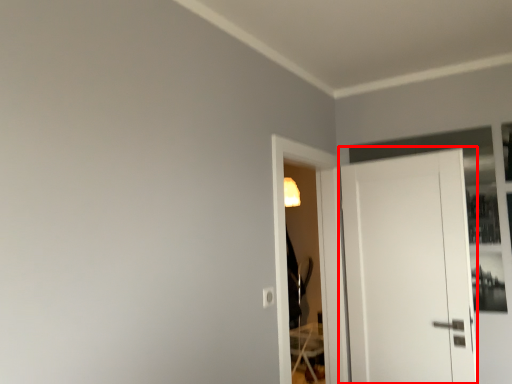
Question: From the image's perspective, what is the correct spatial relationship of door (annotated by the red box) in relation to screen door?

Choices:
 (A) below
 (B) above

Answer: (A)